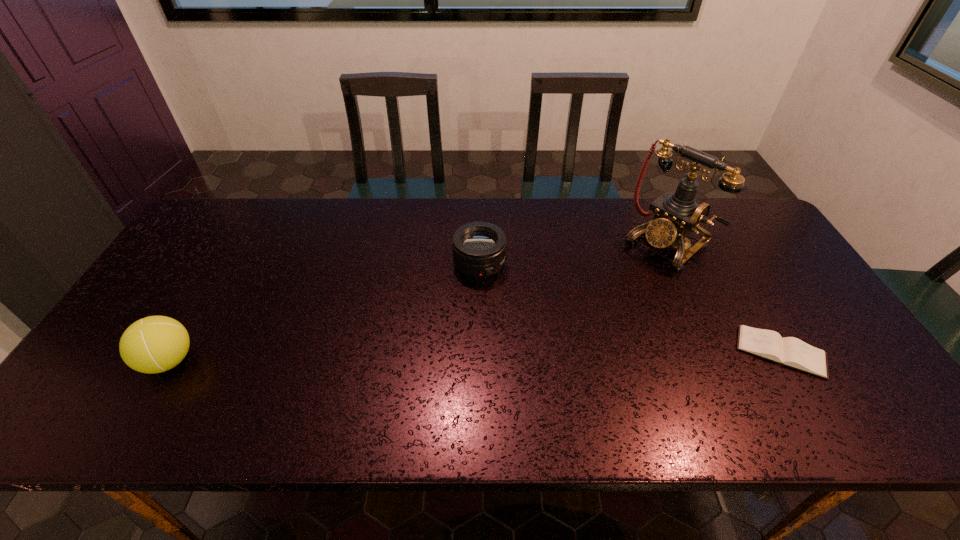
What are the coordinates of `empty space between the leftmost object and the diary` in the screenshot? It's located at (475, 356).

The width and height of the screenshot is (960, 540). I want to click on unoccupied area between the third object from right to left and the diary, so click(x=630, y=308).

This screenshot has width=960, height=540. Find the location of `free space between the telephone and the second object from left to right`. free space between the telephone and the second object from left to right is located at coordinates (573, 254).

Locate an element on the screen. vacant space that's between the shortest object and the second tallest object is located at coordinates (475, 356).

The width and height of the screenshot is (960, 540). I want to click on vacant space that is in between the tallest object and the leftmost object, so click(x=418, y=302).

Locate which object is the closest to the telephoto lens. Please provide its 2D coordinates. Your answer should be formatted as a tuple, i.e. [(x, y)], where the tuple contains the x and y coordinates of a point satisfying the conditions above.

[(677, 214)]

Identify which object is the third nearest to the leftmost object. Please provide its 2D coordinates. Your answer should be formatted as a tuple, i.e. [(x, y)], where the tuple contains the x and y coordinates of a point satisfying the conditions above.

[(789, 351)]

Locate an element on the screen. This screenshot has height=540, width=960. free space that satisfies the following two spatial constraints: 1. on the back side of the tennis ball; 2. on the left side of the third tallest object is located at coordinates click(227, 265).

At what (x,y) coordinates should I click in order to perform the action: click on vacant space that satisfies the following two spatial constraints: 1. on the front side of the telephone; 2. on the left side of the shortest object. Please return your answer as a coordinate pair (x, y). Looking at the image, I should click on (716, 352).

Identify the location of vacant area that satisfies the following two spatial constraints: 1. on the back side of the leftmost object; 2. on the right side of the second object from left to right. The image size is (960, 540). (227, 265).